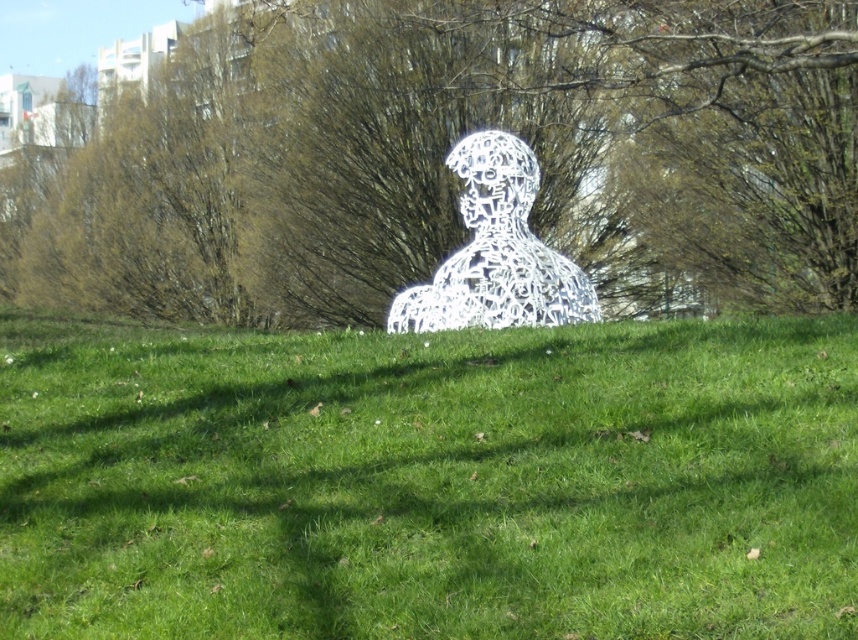
Question: Which of the following is the farthest from the observer?

Choices:
 (A) (143, 340)
 (B) (515, 145)

Answer: (B)

Question: Does green leafy tree at center have a greater width compared to white metallic sculpture at center?

Choices:
 (A) yes
 (B) no

Answer: (A)

Question: Is green grass at center above green leafy tree at center?

Choices:
 (A) yes
 (B) no

Answer: (B)

Question: Which point is farther to the camera?

Choices:
 (A) (551, 266)
 (B) (452, 497)
 (C) (131, 163)

Answer: (C)

Question: Does green grass at center appear on the right side of green leafy tree at center?

Choices:
 (A) no
 (B) yes

Answer: (B)

Question: Estimate the real-world distances between objects in this image. Which object is farther from the green leafy tree at center?

Choices:
 (A) white metallic sculpture at center
 (B) green grass at center

Answer: (B)